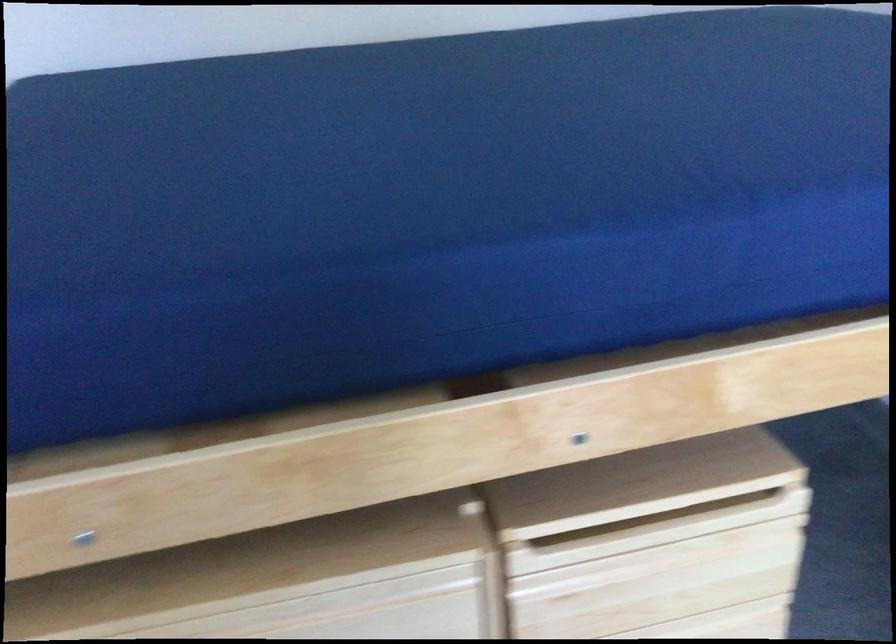
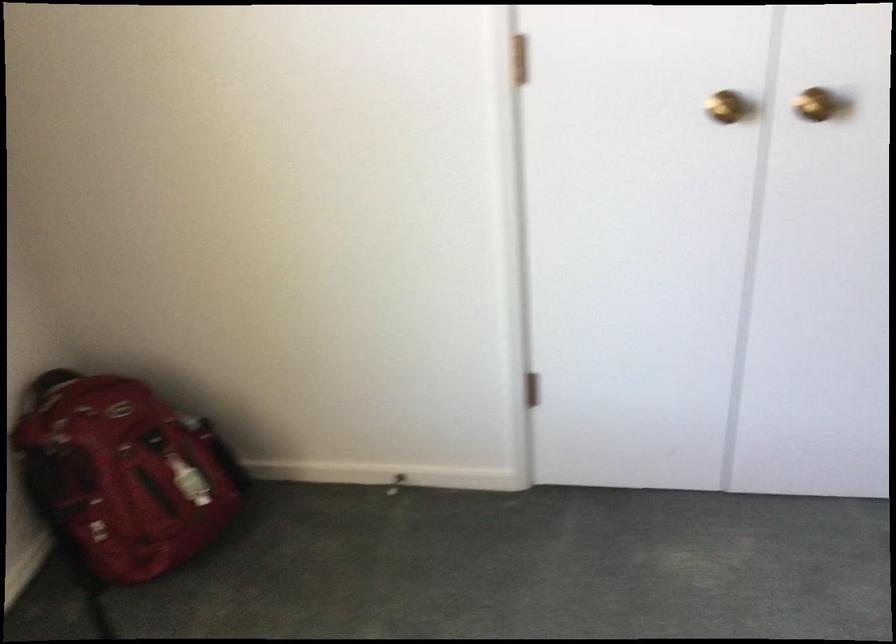
How did the camera likely rotate?

The camera rotated toward left-down.